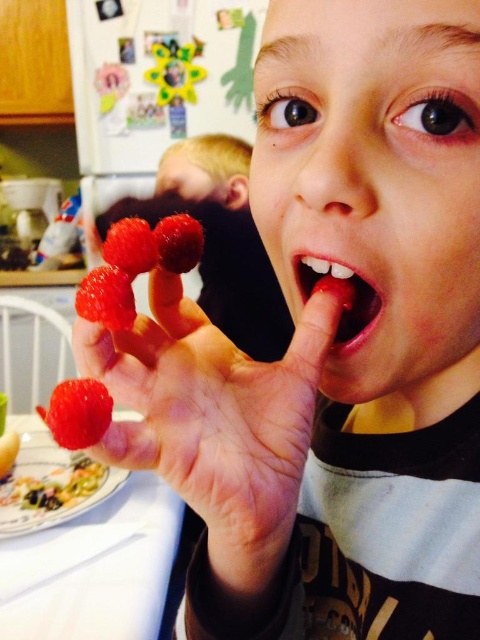
You are a chef preparing a dish that requires placing the shiny red raspberries at center onto the white glossy plate at lower left. The recipe specifies that the raspberries must be placed exactly 18 inches away from the plate. Based on the scene description, can you proceed with the current arrangement?

The shiny red raspberries at center and white glossy plate at lower left are 17.65 inches apart from each other. Since the required distance is 18 inches, the raspberries are slightly closer than needed. To comply with the recipe, you should move the raspberries or plate to increase the distance by approximately 0.35 inches.

You are a chef preparing a fruit platter and need to choose between the red matte strawberry at center and the shiny red strawberry at center. Which strawberry is shorter?

The red matte strawberry at center is shorter than the shiny red strawberry at center.

You are a chef preparing a fruit platter and see the shiny red raspberries at center and the white glossy plate at lower left. Which object is positioned to the right side?

The shiny red raspberries at center are positioned to the right of the white glossy plate at lower left.